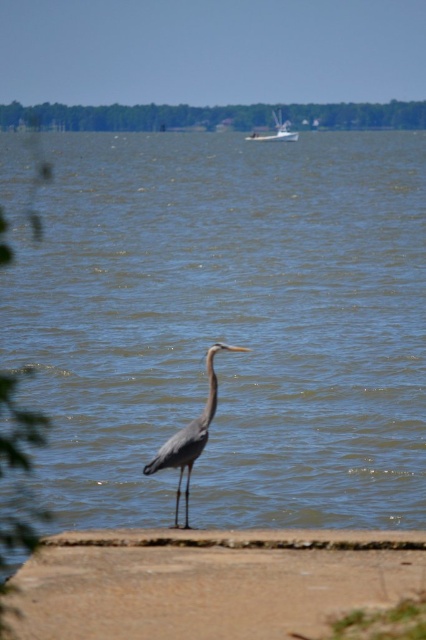
You are standing at the edge of the lake and see the point marked as point (207, 582). What is located at that point?

The point (207, 582) corresponds to the brown sand at lower center.

You are a photographer standing at the lakeside. You want to capture a photo that includes both the blue water at center and the white glossy boat at upper center. Given that your camera has a 50mm lens, which has a field of view of 46 degrees, can you estimate if both objects will fit in the frame without moving your position?

The blue water at center and white glossy boat at upper center are 42.82 meters apart. With a 50mm lens having a 46 degree field of view, the maximum distance between two objects that can fit in the frame is approximately 34 meters. Since 42.82 meters exceeds this, both objects may not fit in the frame without adjusting your position.